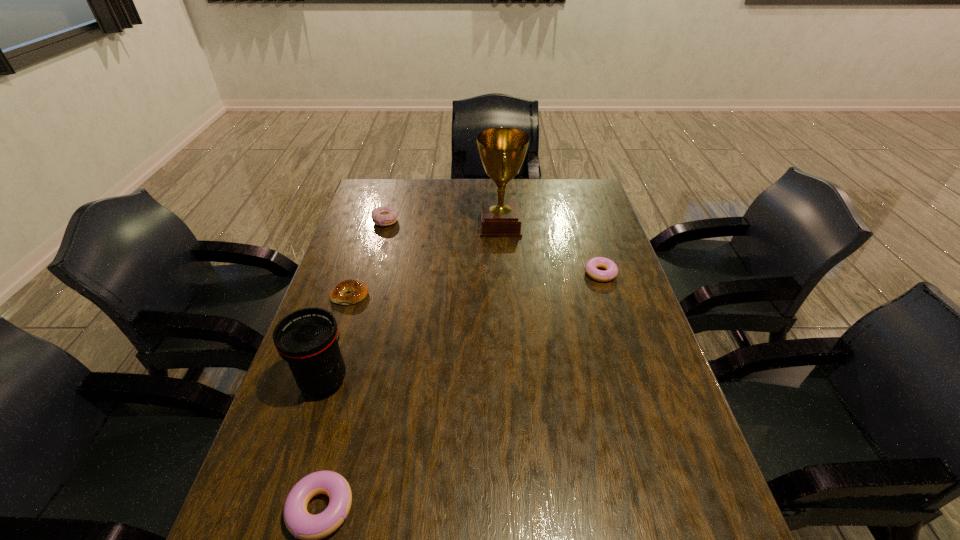
You are a GUI agent. You are given a task and a screenshot of the screen. Output one action in this format:
    pyautogui.click(x=<x>, y=<y>)
    Task: Click on the rightmost object
    
    Given the screenshot: What is the action you would take?
    pyautogui.click(x=610, y=273)

Where is `the shortest doughnut`? The height and width of the screenshot is (540, 960). the shortest doughnut is located at coordinates click(x=610, y=273).

Where is `the farthest doughnut`? the farthest doughnut is located at coordinates (382, 216).

This screenshot has width=960, height=540. I want to click on the tallest object, so click(502, 151).

You are a GUI agent. You are given a task and a screenshot of the screen. Output one action in this format:
    pyautogui.click(x=<x>, y=<y>)
    Task: Click on the second object from right to left
    The height and width of the screenshot is (540, 960).
    Given the screenshot: What is the action you would take?
    pyautogui.click(x=502, y=151)

The image size is (960, 540). I want to click on bagel, so click(358, 290).

Where is `the second tallest object`? Image resolution: width=960 pixels, height=540 pixels. the second tallest object is located at coordinates (307, 339).

Where is `the fifth farthest object`? the fifth farthest object is located at coordinates (307, 339).

This screenshot has width=960, height=540. Identify the location of vacant space positioned on the front of the rightmost doughnut. click(x=628, y=360).

The image size is (960, 540). I want to click on vacant space located 0.240m on the back of the farthest doughnut, so click(x=396, y=183).